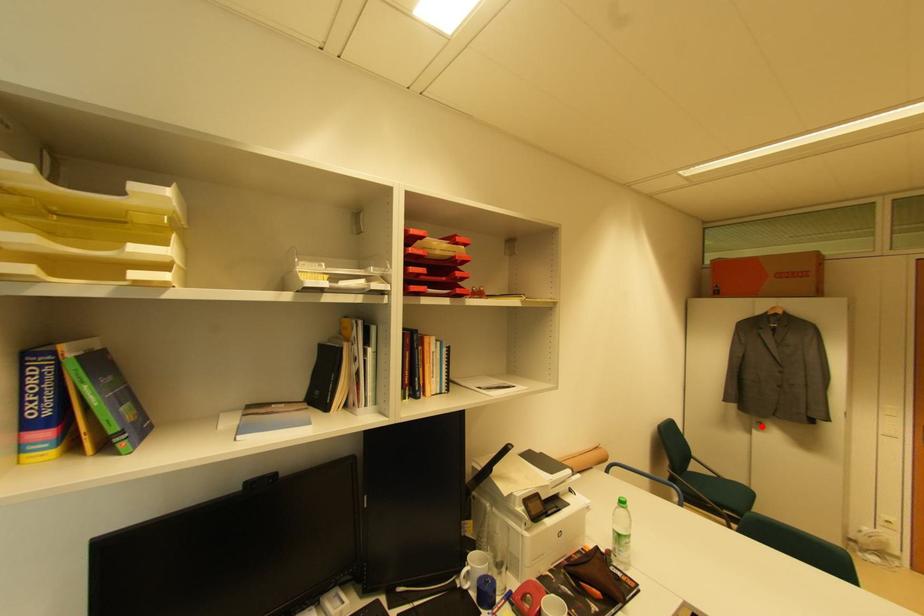
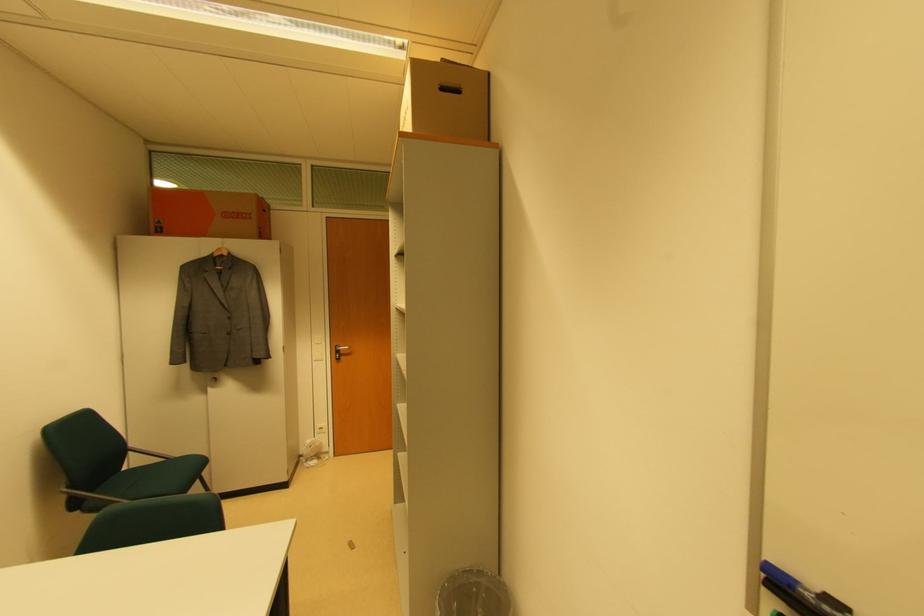
Locate, in the second image, the point that corresponds to the highlighted location in the first image.

(216, 382)